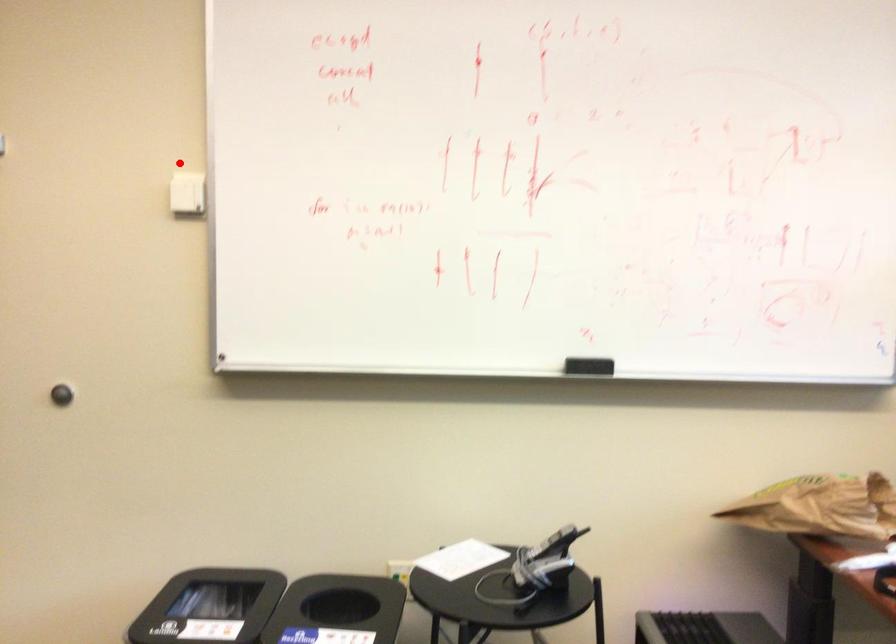
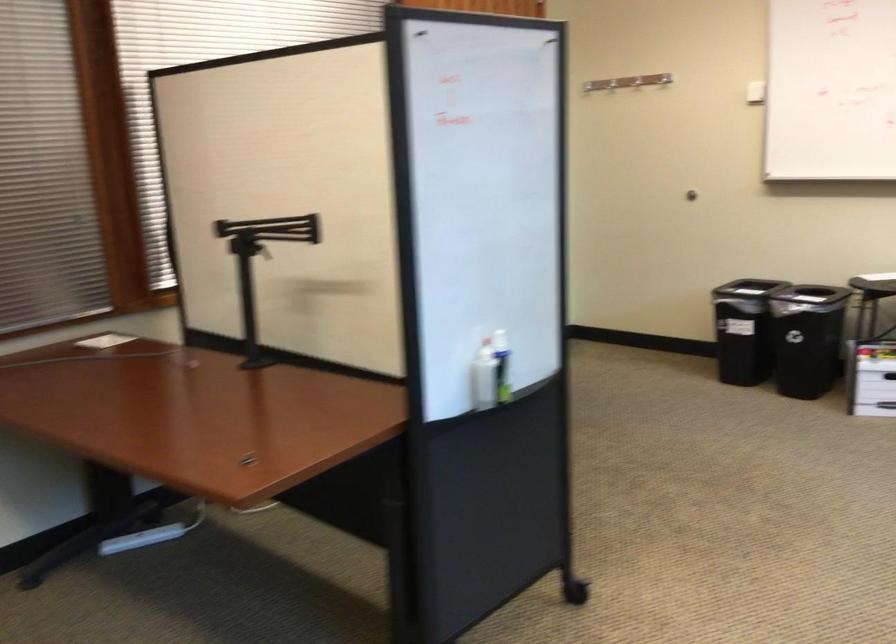
Question: I am providing you with two images of the same scene from different viewpoints. Given a red point in image1, look at the same physical point in image2. Is it:

Choices:
 (A) Closer to the viewpoint
 (B) Farther from the viewpoint

Answer: (B)